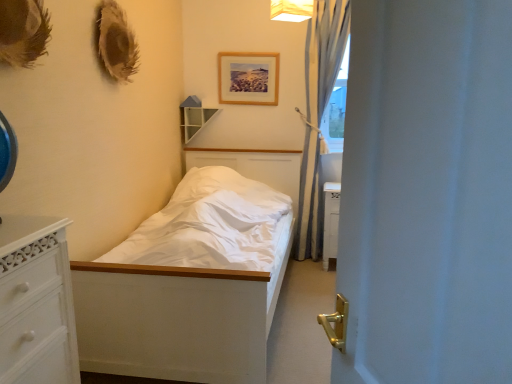
Question: Does light blue sheer curtain at right appear on the right side of white fabric lampshade at upper center?

Choices:
 (A) no
 (B) yes

Answer: (B)

Question: Considering the relative sizes of light blue sheer curtain at right and white fabric lampshade at upper center in the image provided, is light blue sheer curtain at right smaller than white fabric lampshade at upper center?

Choices:
 (A) yes
 (B) no

Answer: (B)

Question: Is light blue sheer curtain at right closer to the viewer compared to white fabric lampshade at upper center?

Choices:
 (A) yes
 (B) no

Answer: (B)

Question: From a real-world perspective, is light blue sheer curtain at right physically below white fabric lampshade at upper center?

Choices:
 (A) no
 (B) yes

Answer: (B)

Question: Is light blue sheer curtain at right outside of white fabric lampshade at upper center?

Choices:
 (A) yes
 (B) no

Answer: (A)

Question: From the image's perspective, relative to white matte bed at center, is white matte door at center above or below?

Choices:
 (A) above
 (B) below

Answer: (A)

Question: Is white matte door at center taller or shorter than white matte bed at center?

Choices:
 (A) short
 (B) tall

Answer: (B)

Question: Which is correct: white matte door at center is inside white matte bed at center, or outside of it?

Choices:
 (A) inside
 (B) outside

Answer: (B)

Question: Looking at their shapes, would you say white matte door at center is wider or thinner than white matte bed at center?

Choices:
 (A) thin
 (B) wide

Answer: (A)

Question: Considering the positions of wooden shelf at upper center and light blue sheer curtain at right in the image, is wooden shelf at upper center wider or thinner than light blue sheer curtain at right?

Choices:
 (A) thin
 (B) wide

Answer: (A)

Question: In terms of height, does wooden shelf at upper center look taller or shorter compared to light blue sheer curtain at right?

Choices:
 (A) short
 (B) tall

Answer: (A)

Question: Visually, is wooden shelf at upper center positioned to the left or to the right of light blue sheer curtain at right?

Choices:
 (A) left
 (B) right

Answer: (A)

Question: Does point (199, 112) appear closer or farther from the camera than point (314, 188)?

Choices:
 (A) farther
 (B) closer

Answer: (A)

Question: Considering the relative positions of light blue sheer curtain at right and wooden picture frame at upper center in the image provided, is light blue sheer curtain at right to the left or to the right of wooden picture frame at upper center?

Choices:
 (A) left
 (B) right

Answer: (B)

Question: From a real-world perspective, is light blue sheer curtain at right physically located above or below wooden picture frame at upper center?

Choices:
 (A) above
 (B) below

Answer: (B)